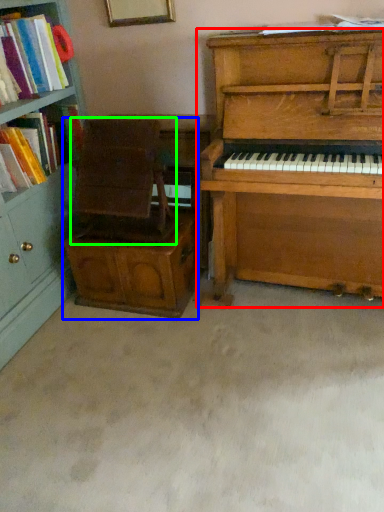
Question: Estimate the real-world distances between objects in this image. Which object is closer to piano (highlighted by a red box), armchair (highlighted by a blue box) or armchair (highlighted by a green box)?

Choices:
 (A) armchair
 (B) armchair

Answer: (A)